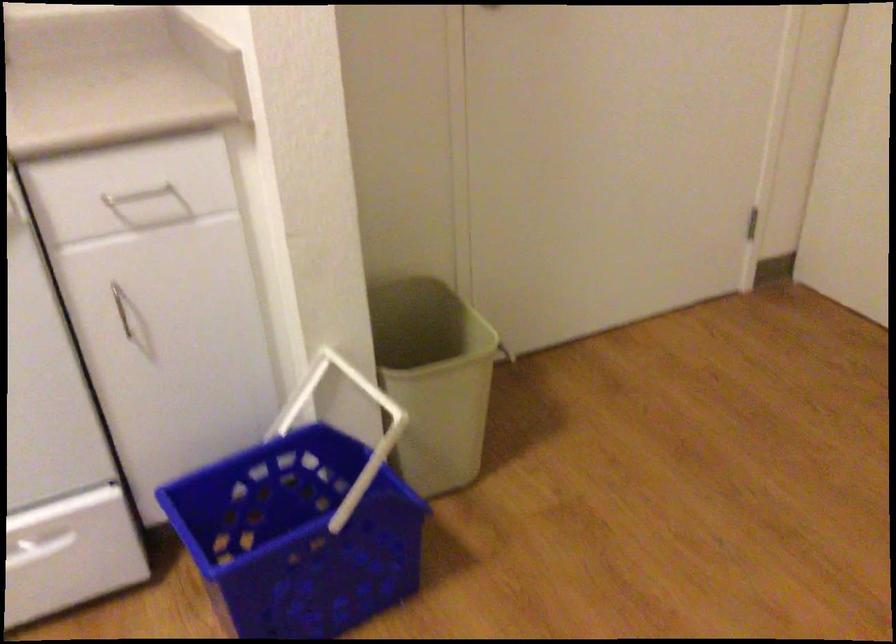
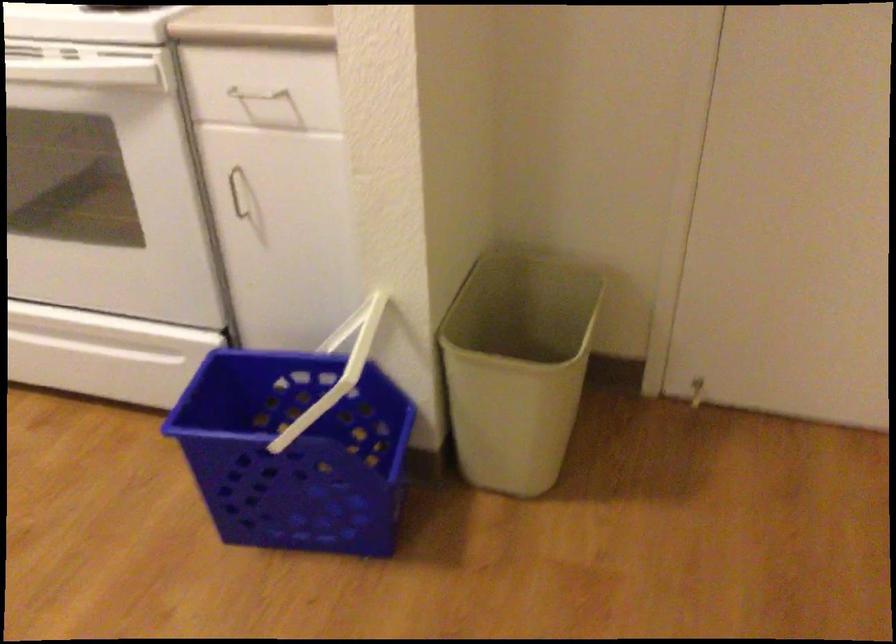
Find the pixel in the second image that matches point (123, 198) in the first image.

(253, 98)